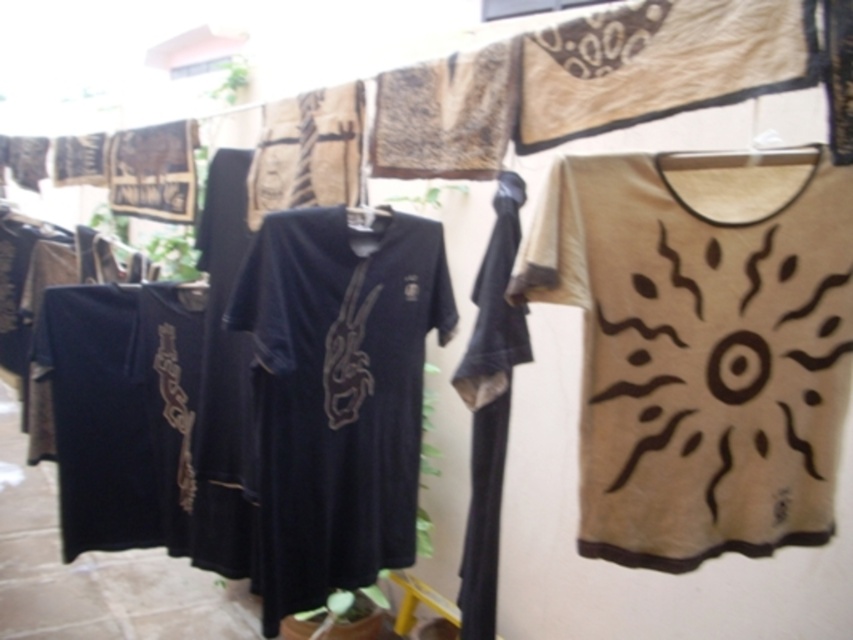
Question: Which object is closer to the camera taking this photo?

Choices:
 (A) beige cotton t-shirt at right
 (B) matte black t-shirt at center

Answer: (A)

Question: Does beige cotton t-shirt at right appear on the right side of matte black t-shirt at center?

Choices:
 (A) no
 (B) yes

Answer: (B)

Question: Is beige cotton t-shirt at right bigger than matte black t-shirt at center?

Choices:
 (A) no
 (B) yes

Answer: (A)

Question: From the image, what is the correct spatial relationship of beige cotton t-shirt at right in relation to matte black t-shirt at center?

Choices:
 (A) above
 (B) below

Answer: (A)

Question: Which point is farther from the camera taking this photo?

Choices:
 (A) (376, 541)
 (B) (746, 244)

Answer: (A)

Question: Among these objects, which one is nearest to the camera?

Choices:
 (A) beige cotton t-shirt at right
 (B) matte black t-shirt at center

Answer: (A)